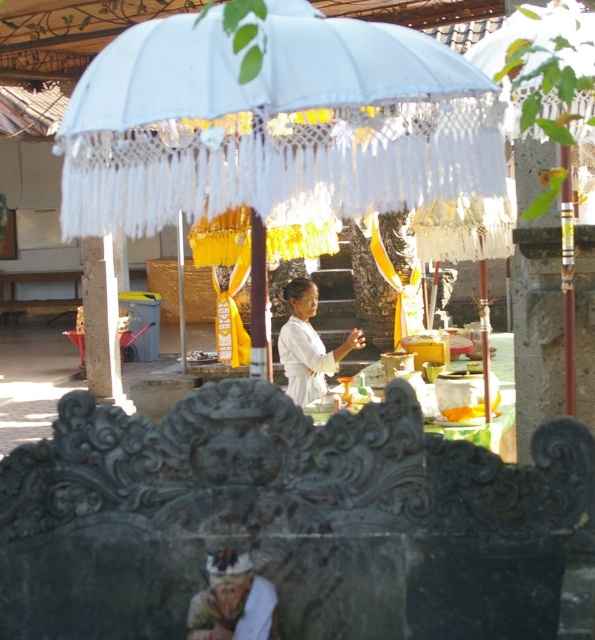
You are a photographer standing in front of the white lace umbrella at center. You want to take a closeup shot of the intricate carvings on the stone pillars supporting it. Considering your current position, will you need to move closer or farther away to focus on the carvings?

The white lace umbrella at center is 4.63 meters away from the camera. To focus on the intricate carvings on the stone pillars supporting it, you would need to move closer to reduce the distance, as the carvings are details that require a closer proximity for clarity.

You are standing in the ceremonial area and notice two points marked in the scene. The first point is at coordinates point (x=402, y=74) and the second is at point (x=306, y=356). Which point is closer to you?

Point (x=402, y=74) is in front of point (x=306, y=356), so it is closer to you.